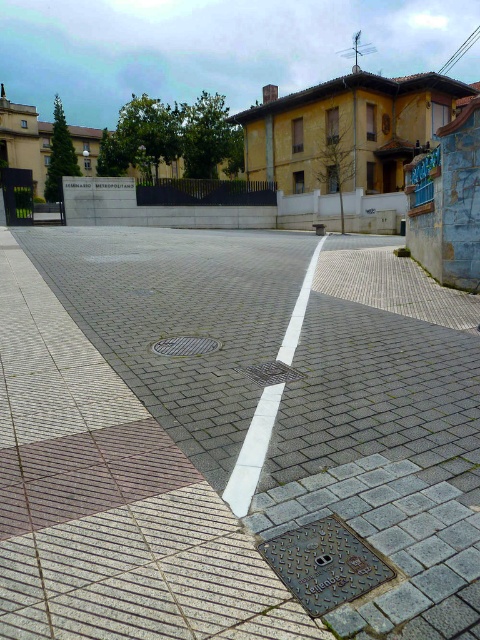
Question: Is gray concrete pavement at center to the left of metallic grid manhole cover at center from the viewer's perspective?

Choices:
 (A) no
 (B) yes

Answer: (A)

Question: Observing the image, what is the correct spatial positioning of gray concrete pavement at center in reference to metallic grid manhole cover at center?

Choices:
 (A) right
 (B) left

Answer: (A)

Question: Is the position of gray concrete pavement at center less distant than that of metallic grid manhole cover at center?

Choices:
 (A) no
 (B) yes

Answer: (B)